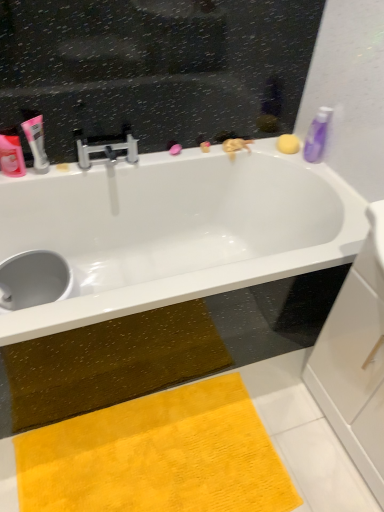
Find the location of a particular element. free region under yellow plush doormat at lower center (from a real-world perspective) is located at coordinates (165, 455).